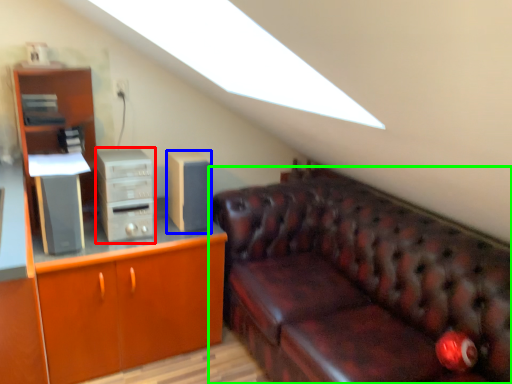
Question: Considering the real-world distances, which object is farthest from computer tower (highlighted by a red box)? speaker (highlighted by a blue box) or studio couch (highlighted by a green box)?

Choices:
 (A) speaker
 (B) studio couch

Answer: (B)